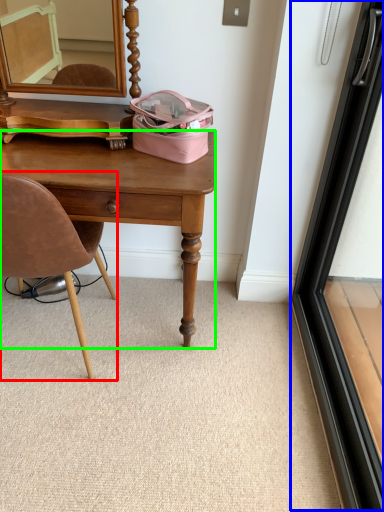
Question: Which is nearer to the chair (highlighted by a red box)? screen door (highlighted by a blue box) or desk (highlighted by a green box).

Choices:
 (A) screen door
 (B) desk

Answer: (B)